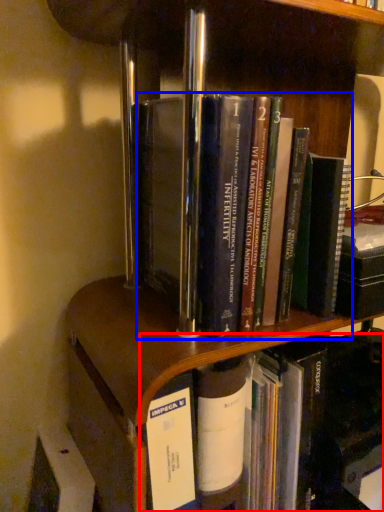
Question: Which object appears closest to the camera in this image, book (highlighted by a red box) or book (highlighted by a blue box)?

Choices:
 (A) book
 (B) book

Answer: (B)